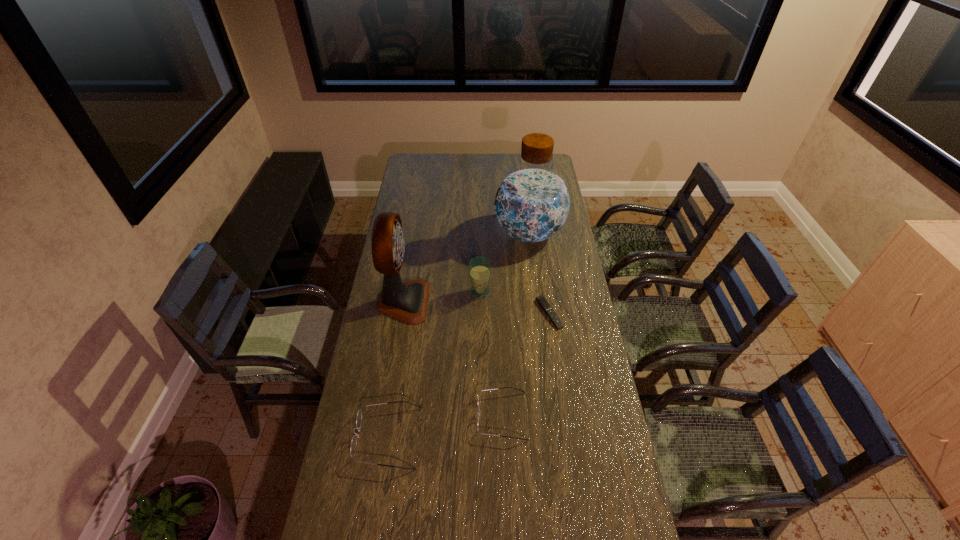
The width and height of the screenshot is (960, 540). Find the location of `free area in between the third shortest object and the glass`. free area in between the third shortest object and the glass is located at coordinates (434, 364).

The image size is (960, 540). What are the coordinates of `free space that is in between the fan and the water jug` in the screenshot? It's located at (467, 267).

Find the location of a particular element. The image size is (960, 540). vacant area between the fourth shortest object and the shorter spectacles is located at coordinates (491, 354).

Identify the location of object that stands as the third closest to the third tallest object. The height and width of the screenshot is (540, 960). (543, 303).

What are the coordinates of `object that ranks as the second closest to the second shortest object` in the screenshot? It's located at (543, 303).